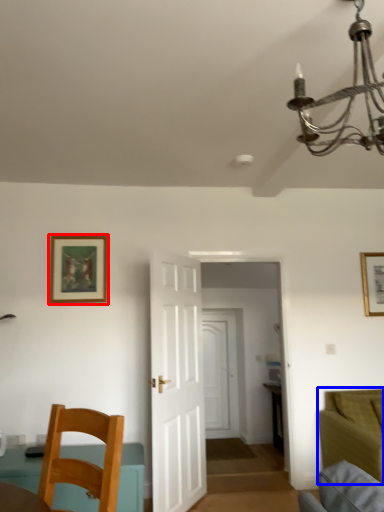
Question: Which object appears farthest to the camera in this image, picture frame (highlighted by a red box) or couch (highlighted by a blue box)?

Choices:
 (A) picture frame
 (B) couch

Answer: (A)